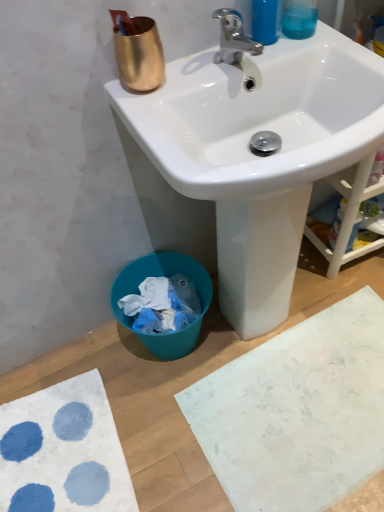
What are the coordinates of `vacant space situated above white matte bath mat at lower right, positioned as the 2th bath mat in left-to-right order (from a real-world perspective)` in the screenshot? It's located at (311, 401).